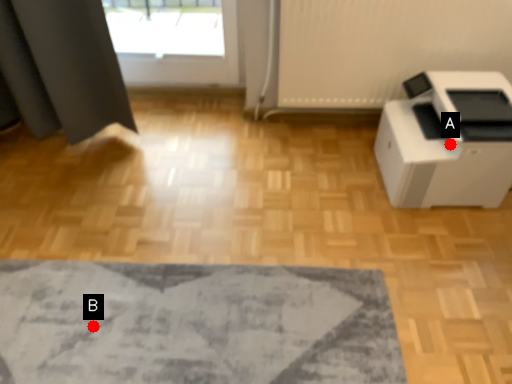
Question: Two points are circled on the image, labeled by A and B beside each circle. Which of the following is the closest to the observer?

Choices:
 (A) A is closer
 (B) B is closer

Answer: (B)